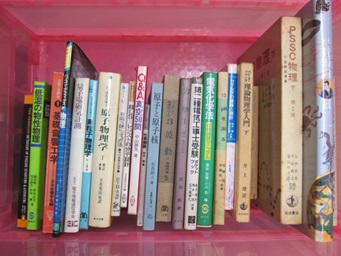
Find the location of a particular element. The image size is (341, 256). picture is located at coordinates (320, 205).